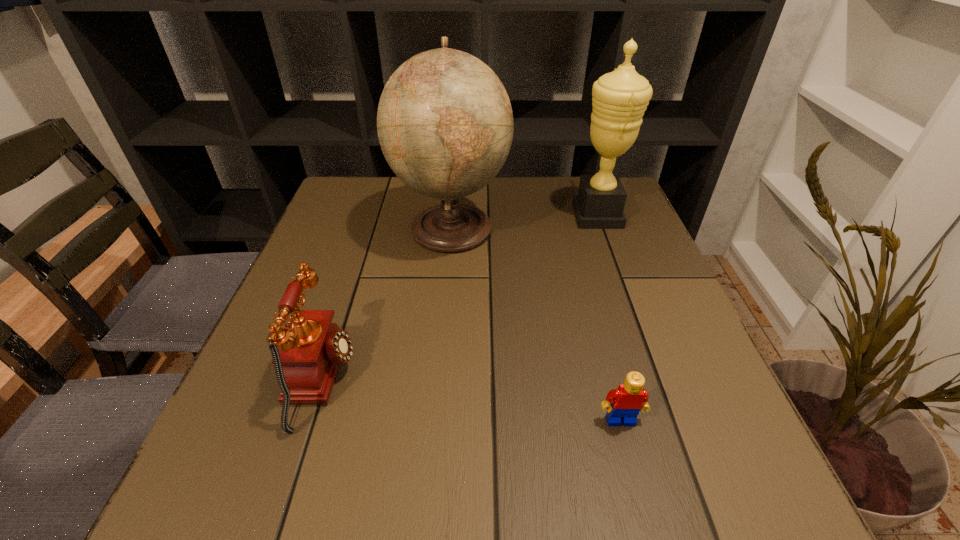
Find the location of a particular element. vacant space located 0.090m on the front-facing side of the Lego is located at coordinates (638, 486).

The image size is (960, 540). Find the location of `globe that is at the far edge`. globe that is at the far edge is located at coordinates (445, 125).

At what (x,y) coordinates should I click in order to perform the action: click on trophy cup at the far edge. Please return your answer as a coordinate pair (x, y). This screenshot has width=960, height=540. Looking at the image, I should click on (619, 99).

The height and width of the screenshot is (540, 960). I want to click on object positioned at the left edge, so click(x=310, y=349).

Identify the location of trophy cup at the right edge. Image resolution: width=960 pixels, height=540 pixels. (619, 99).

What are the coordinates of `Lego at the right edge` in the screenshot? It's located at (628, 399).

Locate an element on the screen. object at the far right corner is located at coordinates (619, 99).

I want to click on vacant area at the far edge, so click(x=562, y=177).

In the image, there is a desktop. Where is `vacant area at the near edge`? The image size is (960, 540). vacant area at the near edge is located at coordinates (405, 512).

Identify the location of vacant space at the left edge of the desktop. Image resolution: width=960 pixels, height=540 pixels. point(336,274).